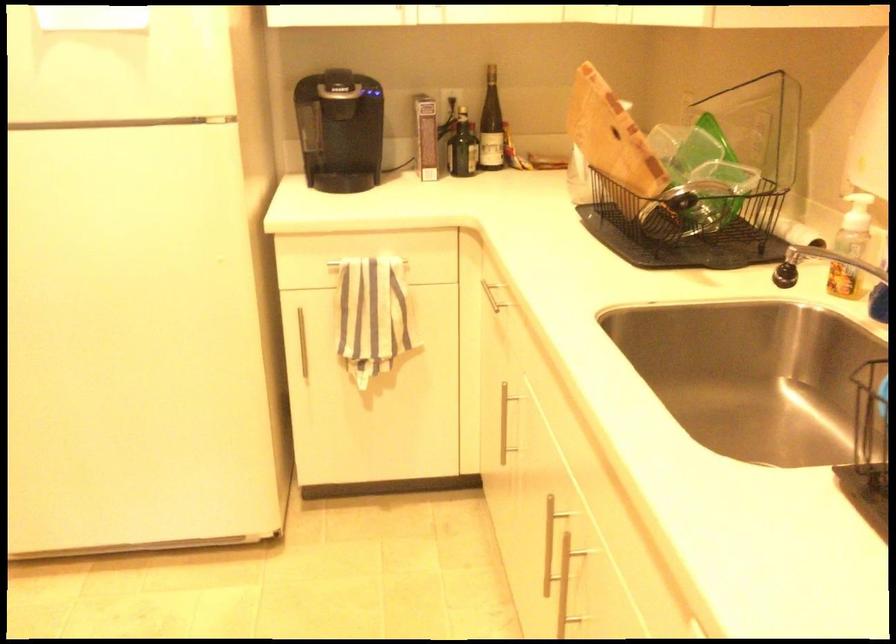
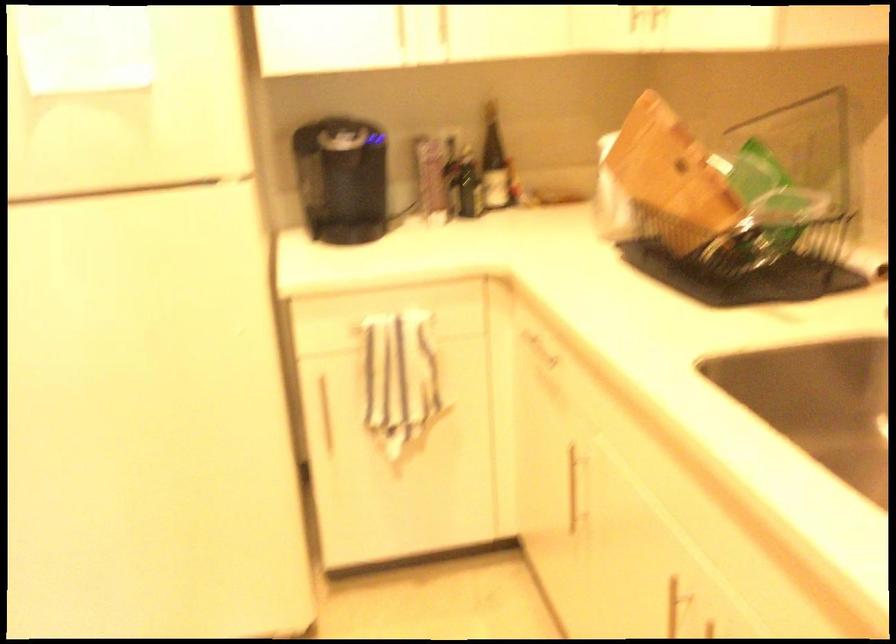
Find the pixel in the second image that matches the point at 607,131 in the first image.

(670, 167)